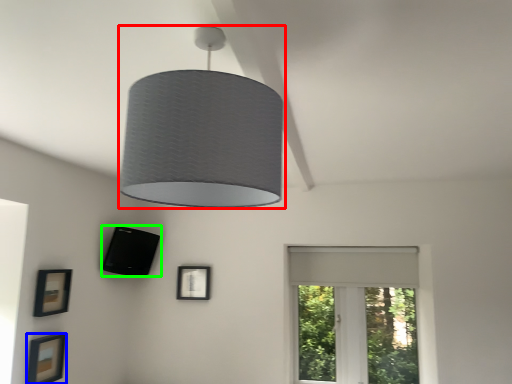
Question: Which is nearer to the lamp (highlighted by a red box)? picture frame (highlighted by a blue box) or picture frame (highlighted by a green box).

Choices:
 (A) picture frame
 (B) picture frame

Answer: (A)